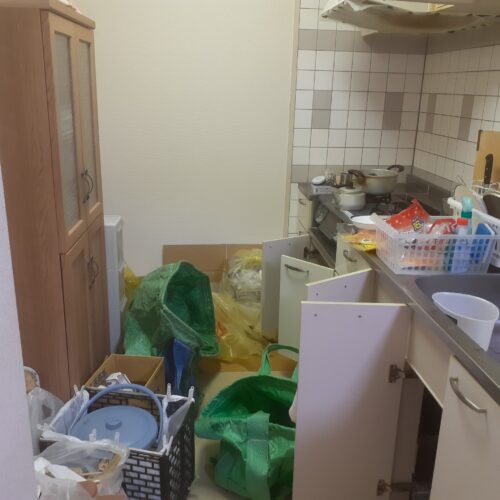
Locate an element on the screen. This screenshot has width=500, height=500. sink is located at coordinates (435, 263), (448, 315).